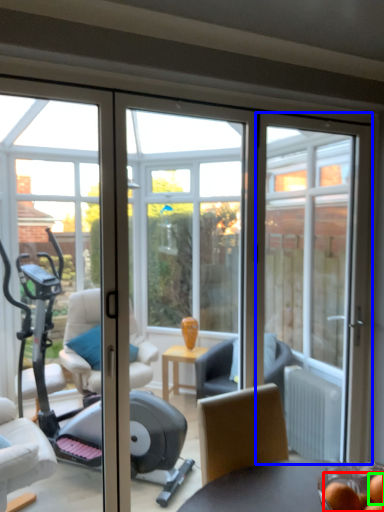
Question: Based on their relative distances, which object is farther from food (highlighted by a red box)? Choose from door (highlighted by a blue box) and food (highlighted by a green box).

Choices:
 (A) door
 (B) food

Answer: (A)